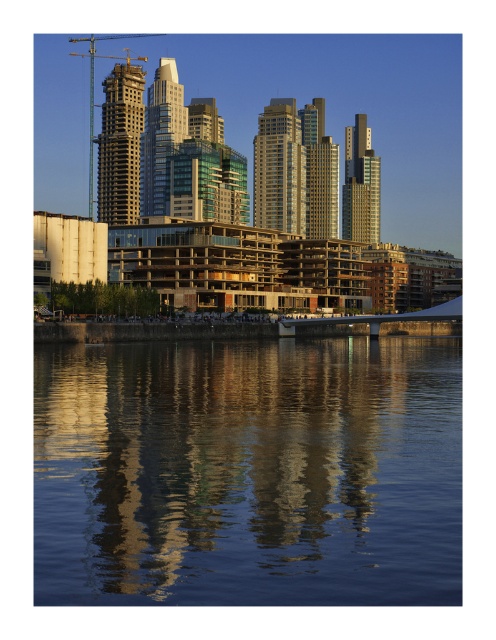
Which is above, gold glass tower at center or glossy glass building at center?

glossy glass building at center is higher up.

Between point (299, 122) and point (164, 202), which one is positioned behind?

Positioned behind is point (299, 122).

I want to click on gold glass tower at center, so click(x=280, y=168).

Is gold glass skyscraper at center below metallic construction crane at upper center?

Yes, gold glass skyscraper at center is below metallic construction crane at upper center.

Is gold glass skyscraper at center to the left of metallic construction crane at upper center from the viewer's perspective?

Incorrect, gold glass skyscraper at center is not on the left side of metallic construction crane at upper center.

Between point (321, 141) and point (90, 115), which one is positioned behind?

Positioned behind is point (90, 115).

You are a GUI agent. You are given a task and a screenshot of the screen. Output one action in this format:
    pyautogui.click(x=<x>, y=<y>)
    Task: Click on the gold glass skyscraper at center
    Image resolution: width=496 pixels, height=640 pixels.
    Given the screenshot: What is the action you would take?
    pyautogui.click(x=319, y=172)

Can you confirm if glassy concrete skyscraper at upper left is taller than gold glass tower at center?

Yes, glassy concrete skyscraper at upper left is taller than gold glass tower at center.

Which is above, glassy concrete skyscraper at upper left or gold glass tower at center?

glassy concrete skyscraper at upper left

Is point (101, 141) more distant than point (255, 134)?

No, (101, 141) is closer to viewer.

Identify the location of glassy concrete skyscraper at upper left. (120, 145).